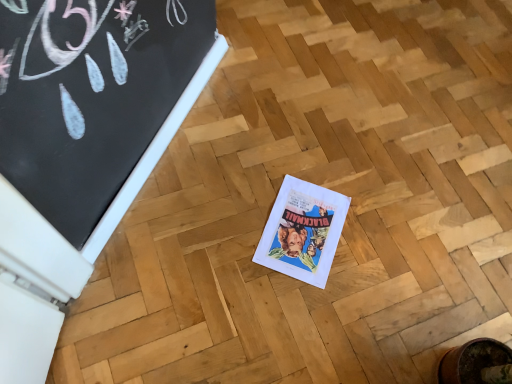
This screenshot has width=512, height=384. Identify the location of free location above white paper comic book at center (from a real-world perspective). (303, 228).